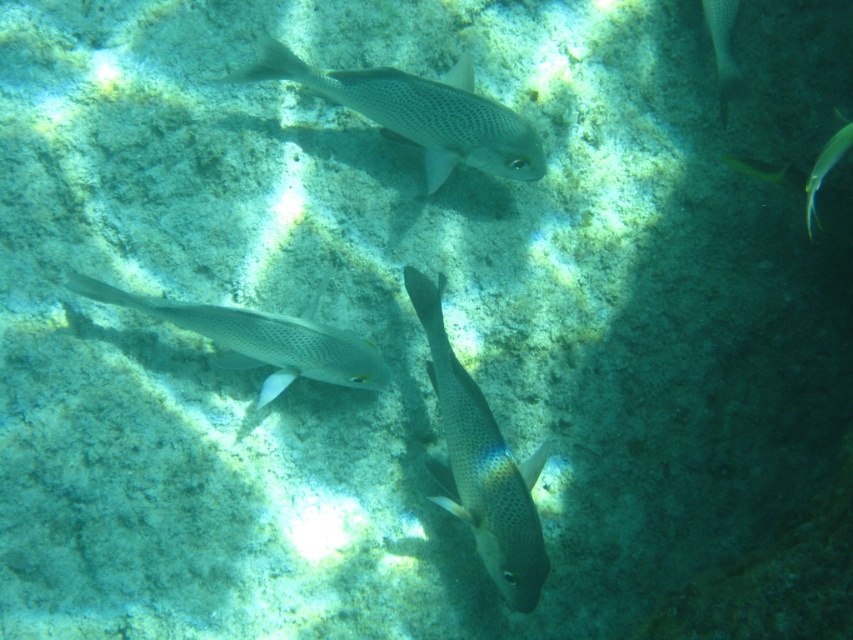
Question: Which point appears closest to the camera in this image?

Choices:
 (A) (845, 147)
 (B) (351, 362)
 (C) (728, 68)

Answer: (A)

Question: Can you confirm if shiny silver fish at center is thinner than shiny silver fish at right?

Choices:
 (A) no
 (B) yes

Answer: (A)

Question: Among these points, which one is nearest to the camera?

Choices:
 (A) (722, 80)
 (B) (367, 365)

Answer: (B)

Question: Among these objects, which one is farthest from the camera?

Choices:
 (A) shiny yellow fish at upper right
 (B) speckled silver fish at upper center
 (C) shiny silver fish at center

Answer: (A)

Question: Does speckled silver fish at center lie in front of shiny yellow fish at upper right?

Choices:
 (A) yes
 (B) no

Answer: (A)

Question: Can you confirm if speckled silver fish at center is positioned to the left of shiny silver fish at right?

Choices:
 (A) yes
 (B) no

Answer: (A)